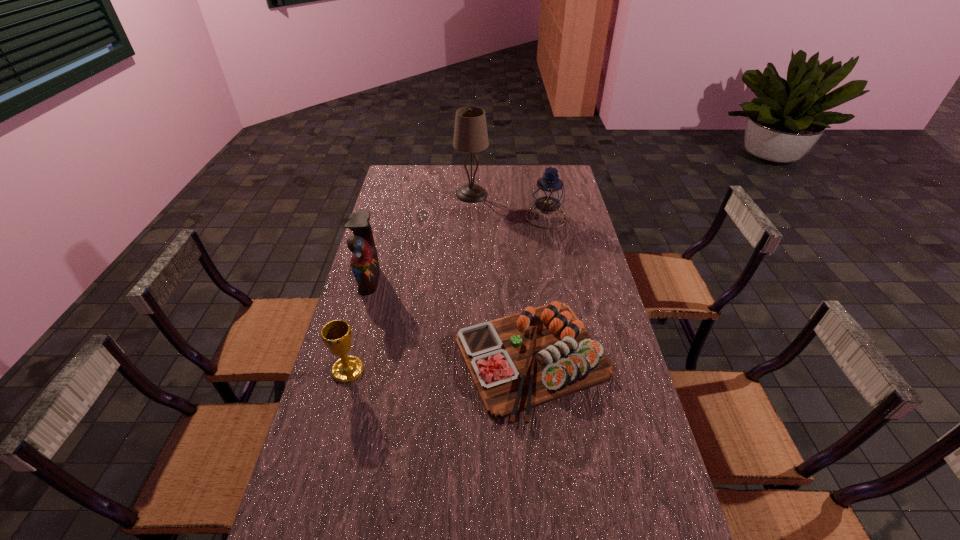
At what (x,y) coordinates should I click in order to perform the action: click on the tallest object. Please return your answer as a coordinate pair (x, y). The image size is (960, 540). Looking at the image, I should click on (470, 133).

Where is `the farthest object`? Image resolution: width=960 pixels, height=540 pixels. the farthest object is located at coordinates (470, 133).

This screenshot has width=960, height=540. What are the coordinates of `the third nearest object` in the screenshot? It's located at (364, 262).

Locate an element on the screen. Image resolution: width=960 pixels, height=540 pixels. the second farthest object is located at coordinates (549, 193).

Where is `the second shortest object`? The width and height of the screenshot is (960, 540). the second shortest object is located at coordinates (336, 335).

The height and width of the screenshot is (540, 960). In order to click on the shortest object in this screenshot , I will do `click(521, 361)`.

I want to click on vacant space located 0.260m on the front-facing side of the tallest object, so click(x=544, y=194).

Where is `vacant space positioned 0.130m at the face of the third nearest object`? Image resolution: width=960 pixels, height=540 pixels. vacant space positioned 0.130m at the face of the third nearest object is located at coordinates (416, 279).

In order to click on free location located 0.160m on the front-facing side of the fourth nearest object in this screenshot , I will do `click(490, 217)`.

Locate an element on the screen. free space located on the front-facing side of the fourth nearest object is located at coordinates (505, 217).